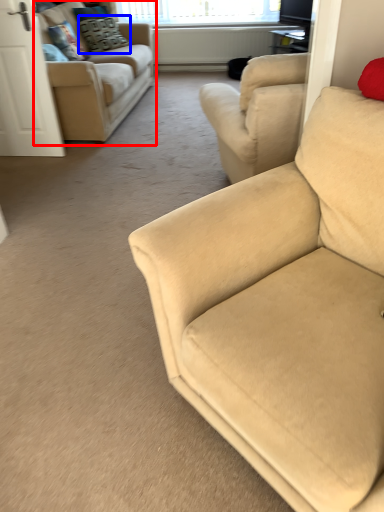
Question: Which object appears farthest to the camera in this image, studio couch (highlighted by a red box) or pillow (highlighted by a blue box)?

Choices:
 (A) studio couch
 (B) pillow

Answer: (B)